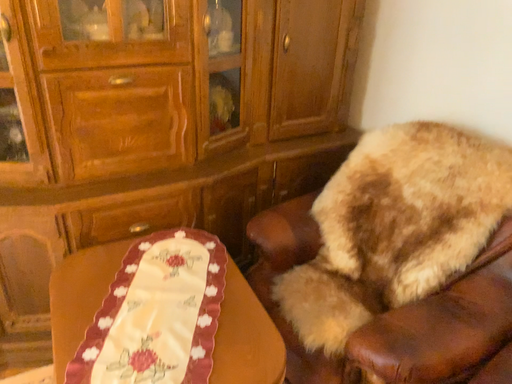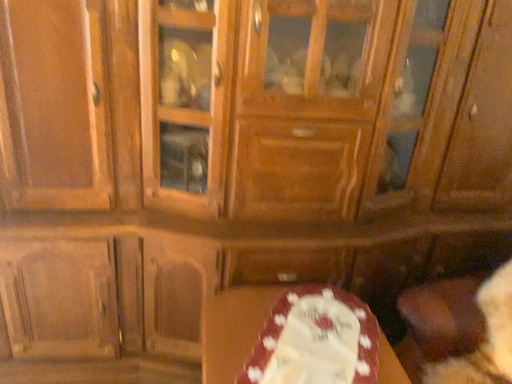
Question: How did the camera likely rotate when shooting the video?

Choices:
 (A) rotated upward
 (B) rotated downward

Answer: (A)